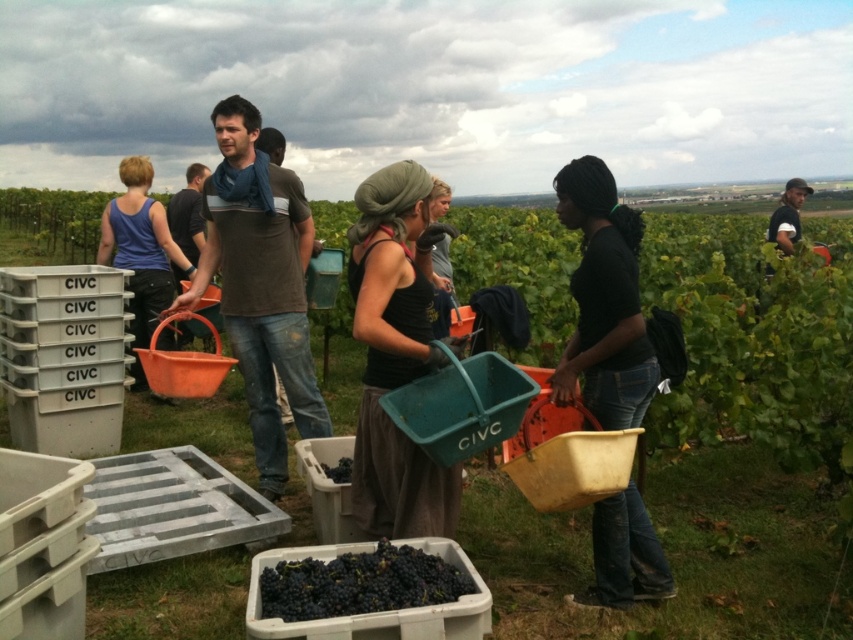
Question: Does dark brown fabric headscarf at center have a larger size compared to matte blue tank top at left?

Choices:
 (A) yes
 (B) no

Answer: (B)

Question: Does brown cotton shirt at center appear under dark brown fabric headscarf at center?

Choices:
 (A) no
 (B) yes

Answer: (A)

Question: Estimate the real-world distances between objects in this image. Which object is closer to the black matte shirt at center?

Choices:
 (A) dark purple grapes at center
 (B) matte blue tank top at left
 (C) dark matte grapes at center

Answer: (C)

Question: Can you confirm if dark matte grapes at center is wider than dark purple grapes at center?

Choices:
 (A) yes
 (B) no

Answer: (A)

Question: Which of these objects is positioned closest to the dark purple grapes at center?

Choices:
 (A) dark brown fabric headscarf at center
 (B) black matte shirt at center

Answer: (A)

Question: Estimate the real-world distances between objects in this image. Which object is farther from the dark brown fabric headscarf at center?

Choices:
 (A) brown cotton shirt at center
 (B) matte blue tank top at left

Answer: (B)